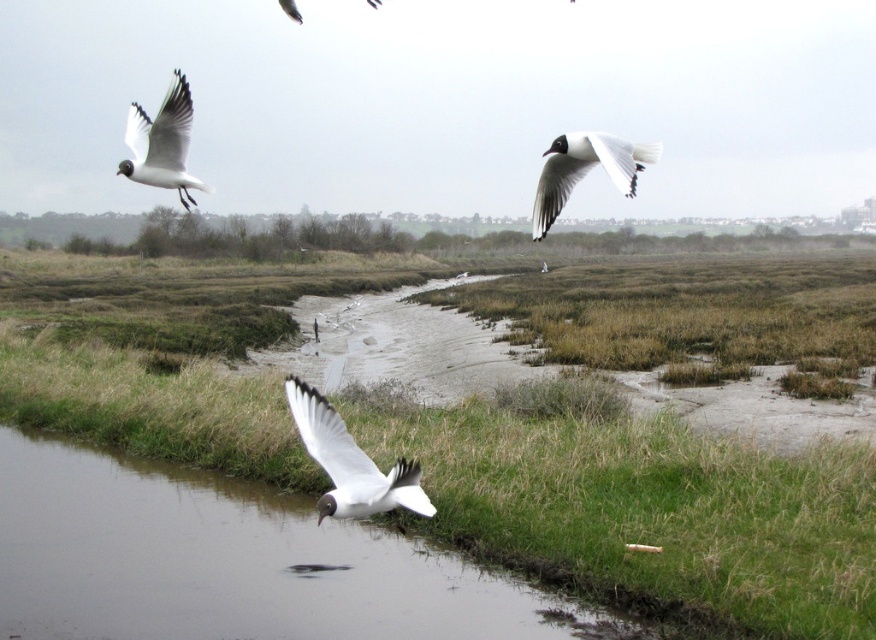
Question: Which object is closer to the camera taking this photo?

Choices:
 (A) clear water at lower center
 (B) white matte bird at upper right

Answer: (B)

Question: Is the position of white matte bird at center less distant than that of white matte bird at upper left?

Choices:
 (A) no
 (B) yes

Answer: (B)

Question: Is clear water at lower center thinner than white matte bird at upper right?

Choices:
 (A) no
 (B) yes

Answer: (B)

Question: Does clear water at lower center have a greater width compared to white matte bird at center?

Choices:
 (A) yes
 (B) no

Answer: (A)

Question: Which of the following is the farthest from the observer?

Choices:
 (A) clear water at lower center
 (B) green grass at lower center

Answer: (A)

Question: Which object is closer to the camera taking this photo?

Choices:
 (A) white matte bird at upper left
 (B) clear water at lower center

Answer: (A)